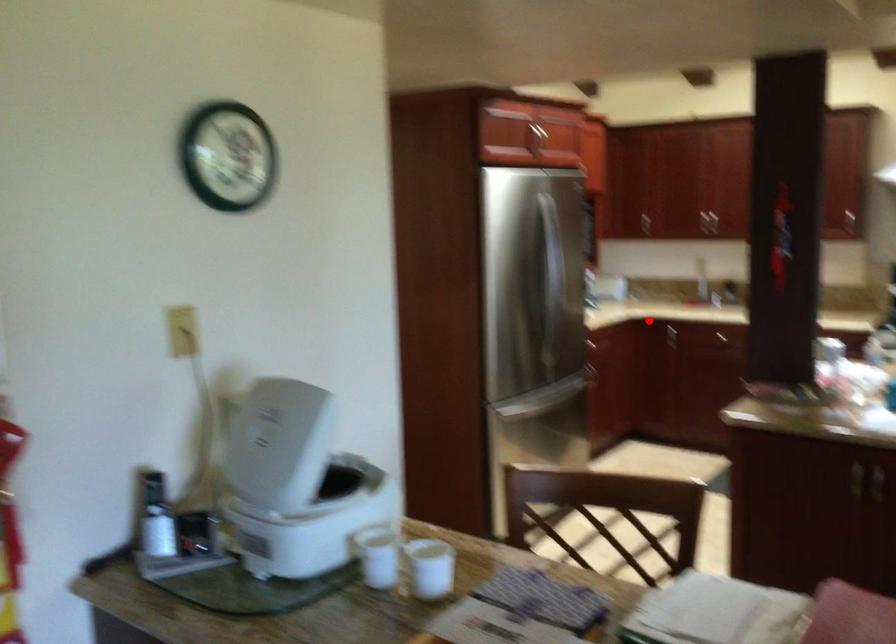
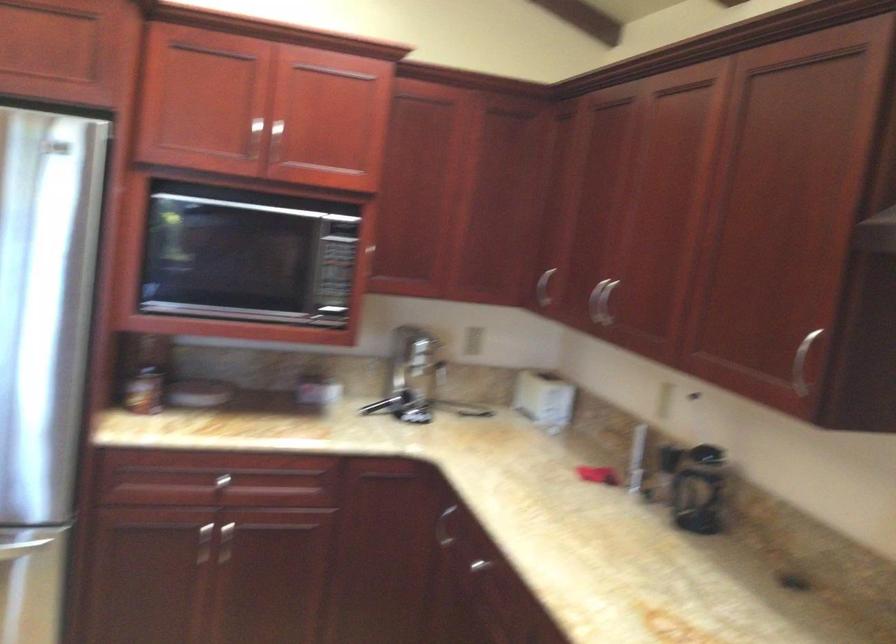
Question: I am providing you with two images of the same scene from different viewpoints. Image1 has a red point marked. In image2, the corresponding 3D location appears at what relative position? Reply with the corresponding letter.

Choices:
 (A) Closer
 (B) Farther

Answer: (A)